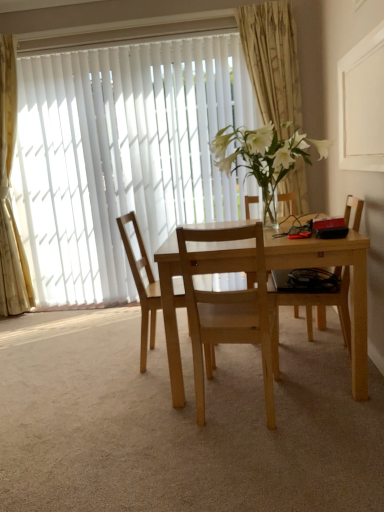
Image resolution: width=384 pixels, height=512 pixels. In order to click on free spot below white sheer curtain at left, the second curtain from the right (from a real-world perspective) in this screenshot , I will do `click(38, 311)`.